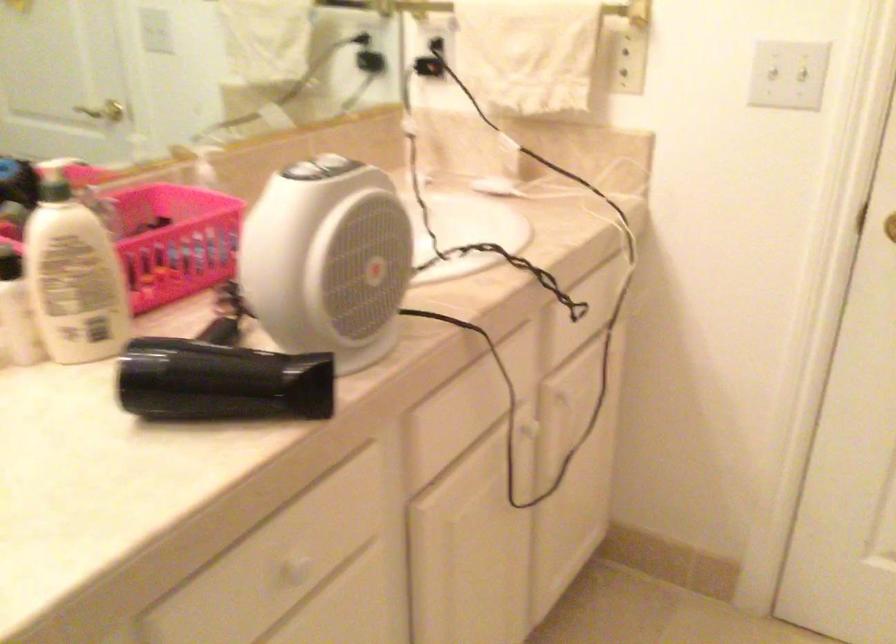
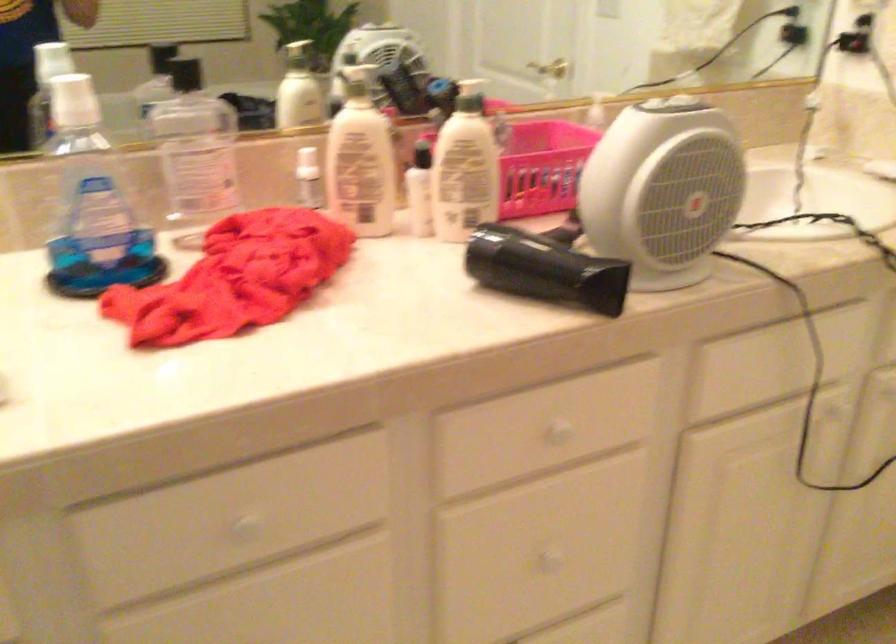
Question: Based on the continuous images, in which direction is the camera rotating? Reply with the corresponding letter.

Choices:
 (A) Left
 (B) Right
 (C) Up
 (D) Down

Answer: (A)